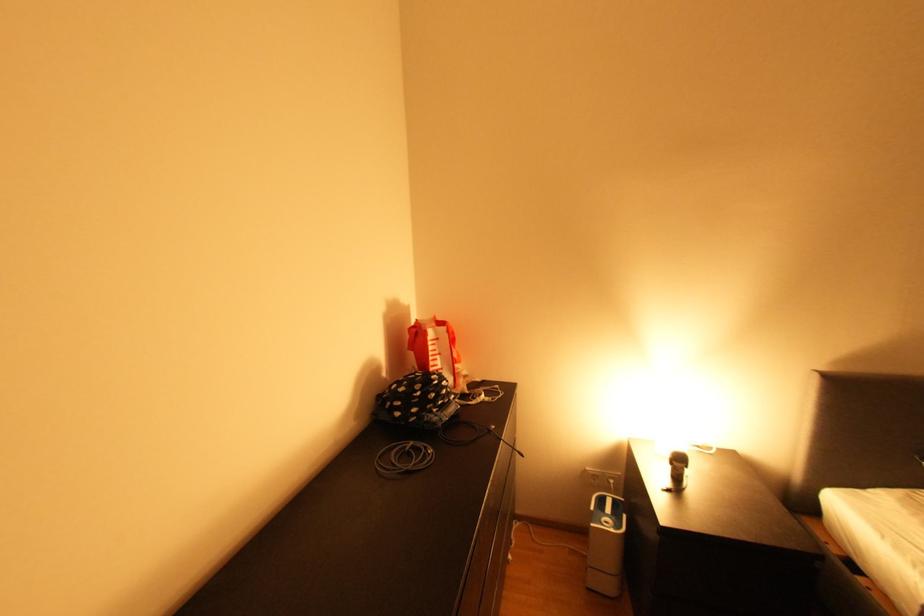
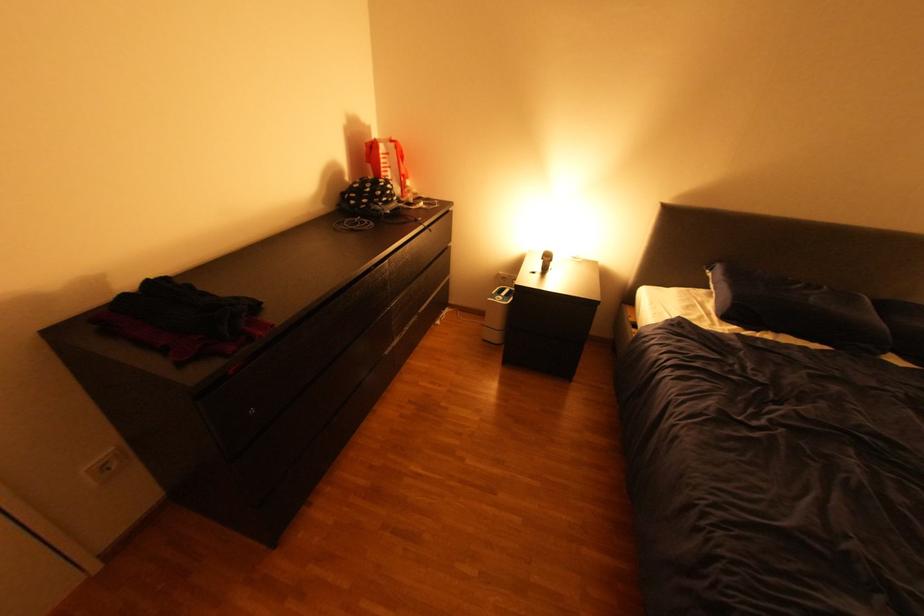
The point at (418, 307) is marked in the first image. Where is the corresponding point in the second image?

(379, 129)